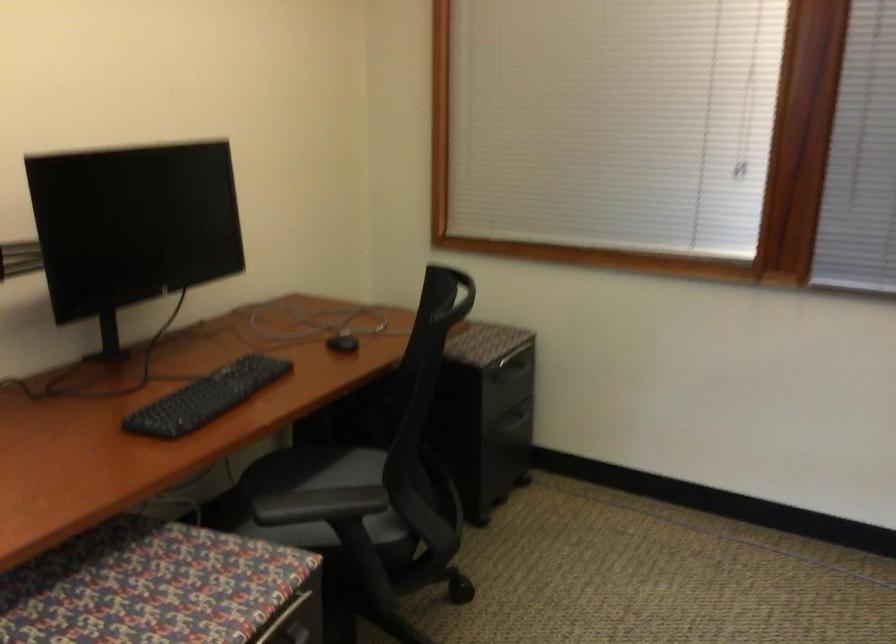
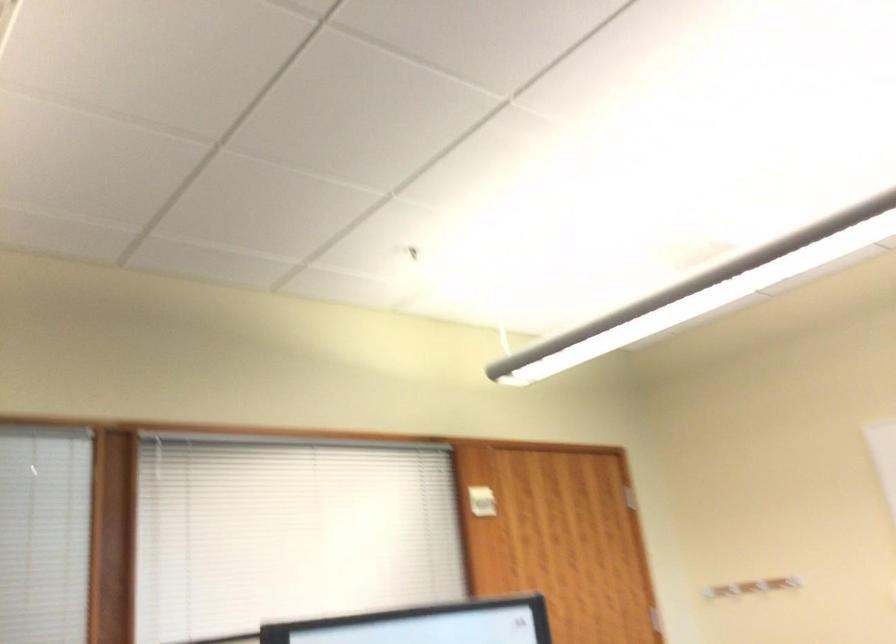
How did the camera likely rotate?

The rotation direction of the camera is right-up.